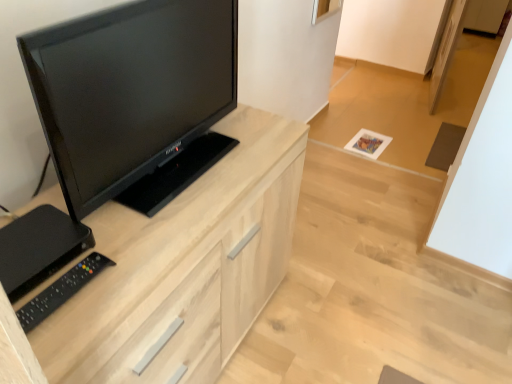
Measure the distance between black glossy tv at left and camera.

The distance of black glossy tv at left from camera is 26.44 inches.

Find the location of a particular element. Image resolution: width=512 pixels, height=384 pixels. black glossy tv at left is located at coordinates (130, 89).

Considering the sizes of objects black glossy tv at left and light wood cabinet at center in the image provided, who is bigger, black glossy tv at left or light wood cabinet at center?

Bigger between the two is light wood cabinet at center.

Who is taller, black glossy tv at left or light wood cabinet at center?

With more height is light wood cabinet at center.

Are black glossy tv at left and light wood cabinet at center making contact?

No, black glossy tv at left is not making contact with light wood cabinet at center.

Would you say light wood cabinet at center contains black plastic remote at lower left?

Yes, black plastic remote at lower left is inside light wood cabinet at center.

Is point (200, 248) closer or farther from the camera than point (40, 317)?

Point (200, 248) is farther from the camera than point (40, 317).

Is light wood cabinet at center bigger or smaller than black plastic remote at lower left?

Clearly, light wood cabinet at center is larger in size than black plastic remote at lower left.

Does light wood cabinet at center lie in front of black plastic remote at lower left?

Yes, light wood cabinet at center is in front of black plastic remote at lower left.

Can we say light wood cabinet at center lies outside black glossy tv at left?

Yes.

Based on the photo, which is further, (208, 346) or (188, 61)?

The point (208, 346) is farther.

From a real-world perspective, between light wood cabinet at center and black glossy tv at left, who is vertically lower?

In real-world perspective, light wood cabinet at center is lower.

Is point (94, 275) more distant than point (165, 138)?

No, it is in front of (165, 138).

Identify the location of television in front of the black plastic remote at lower left. The width and height of the screenshot is (512, 384). (130, 89).

Is black plastic remote at lower left placed right next to black glossy tv at left?

No, black plastic remote at lower left is not beside black glossy tv at left.

Which object is positioned more to the right, black glossy tv at left or black plastic remote at lower left?

From the viewer's perspective, black glossy tv at left appears more on the right side.

Based on the photo, would you say black glossy tv at left is outside black plastic remote at lower left?

Yes, black glossy tv at left is outside of black plastic remote at lower left.

In order to click on television in front of the black plastic remote at lower left in this screenshot , I will do tap(130, 89).

Is black plastic remote at lower left at the back of black glossy tv at left?

No, black glossy tv at left's orientation is not away from black plastic remote at lower left.

Is black plastic remote at lower left aimed at light wood cabinet at center?

No, black plastic remote at lower left does not turn towards light wood cabinet at center.

Does black plastic remote at lower left contain light wood cabinet at center?

No, black plastic remote at lower left does not contain light wood cabinet at center.

From the image's perspective, which one is positioned lower, black plastic remote at lower left or light wood cabinet at center?

light wood cabinet at center appears lower in the image.

Is black plastic remote at lower left touching light wood cabinet at center?

They are not placed beside each other.

Identify the location of television above the light wood cabinet at center (from the image's perspective). (130, 89).

The height and width of the screenshot is (384, 512). I want to click on cabinetry on the right of black plastic remote at lower left, so click(183, 266).

Estimate the real-world distances between objects in this image. Which object is further from light wood cabinet at center, black glossy tv at left or black plastic remote at lower left?

The object further to light wood cabinet at center is black plastic remote at lower left.

From the image, which object appears to be nearer to black plastic remote at lower left, black glossy tv at left or light wood cabinet at center?

Among the two, light wood cabinet at center is located nearer to black plastic remote at lower left.

From the image, which object appears to be nearer to black glossy tv at left, black plastic remote at lower left or light wood cabinet at center?

light wood cabinet at center is closer to black glossy tv at left.

Based on their spatial positions, is light wood cabinet at center or black glossy tv at left further from black plastic remote at lower left?

black glossy tv at left is further to black plastic remote at lower left.

Which object lies further to the anchor point light wood cabinet at center, black plastic remote at lower left or black glossy tv at left?

Among the two, black plastic remote at lower left is located further to light wood cabinet at center.

Based on their spatial positions, is light wood cabinet at center or black plastic remote at lower left closer to black glossy tv at left?

light wood cabinet at center.

This screenshot has width=512, height=384. In order to click on equipment between black glossy tv at left and light wood cabinet at center in the up-down direction in this screenshot , I will do `click(61, 290)`.